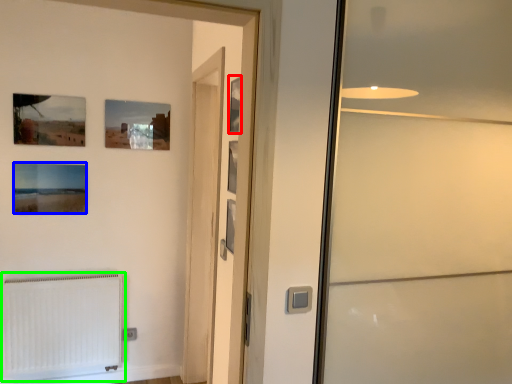
Question: Which object is the closest to the picture frame (highlighted by a red box)? Choose among these: picture frame (highlighted by a blue box) or radiator (highlighted by a green box).

Choices:
 (A) picture frame
 (B) radiator

Answer: (A)